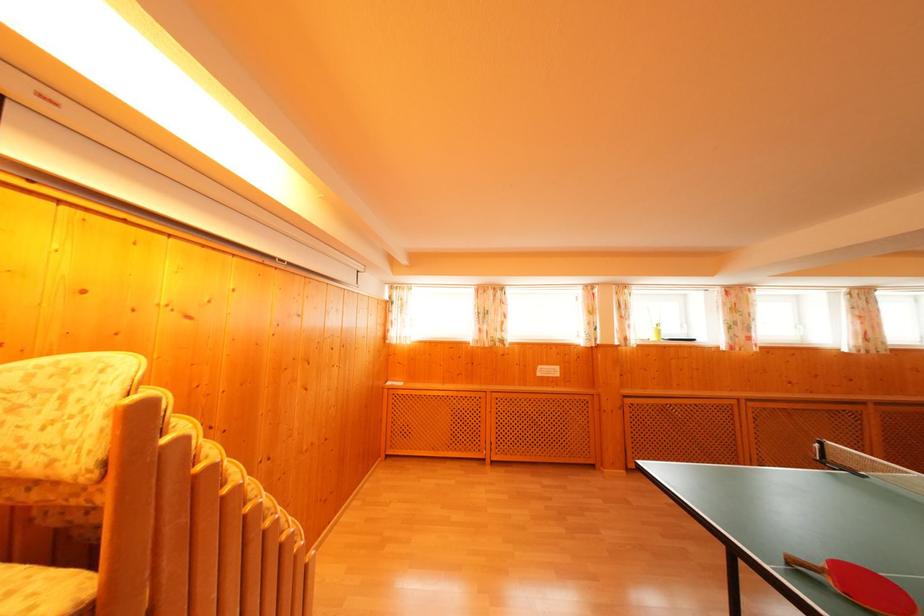
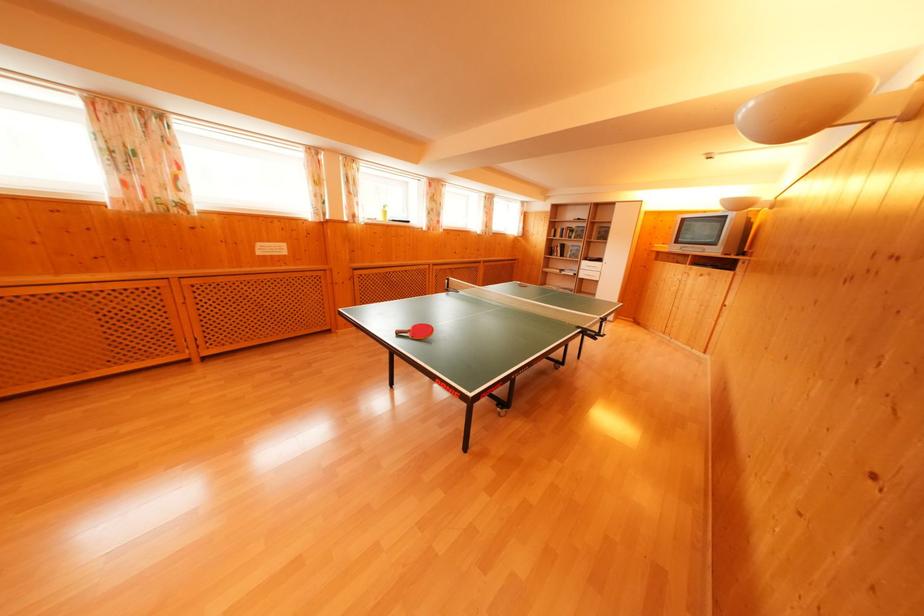
First-person continuous shooting, in which direction is the camera rotating?

The camera rotated toward right-down.